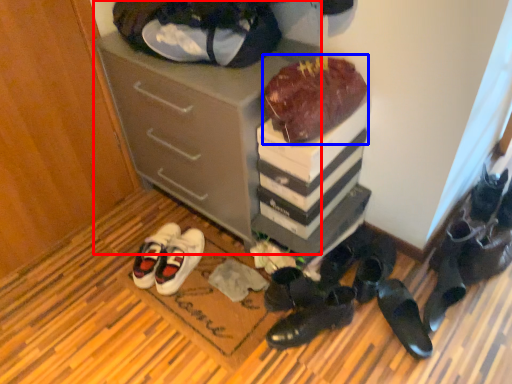
Question: Which object is further to the camera taking this photo, cabinetry (highlighted by a red box) or chocolate cake (highlighted by a blue box)?

Choices:
 (A) cabinetry
 (B) chocolate cake

Answer: (A)